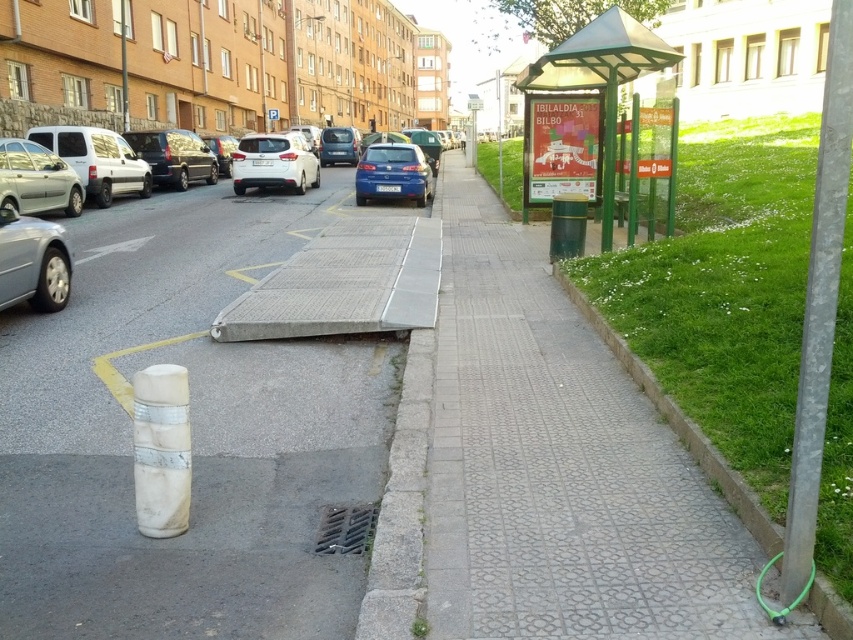
Question: Does green grass at lower right appear under metallic silver car at left?

Choices:
 (A) yes
 (B) no

Answer: (A)

Question: Which point is closer to the camera?

Choices:
 (A) green metallic bus stop at upper right
 (B) white concrete sidewalk at center
 (C) silver metallic pole at right

Answer: (C)

Question: Does metallic silver car at left appear over dark gray metallic van at left?

Choices:
 (A) yes
 (B) no

Answer: (B)

Question: Which point is closer to the camera?

Choices:
 (A) 300,177
 (B) 628,22

Answer: (B)

Question: Based on their relative distances, which object is farther from the satin white suv at center?

Choices:
 (A) green metallic bus stop at upper right
 (B) green grass at lower right
 (C) silver metallic pole at right
 (D) matte blue hatchback at center

Answer: (C)

Question: Does green grass at lower right appear under metallic silver car at left?

Choices:
 (A) no
 (B) yes

Answer: (B)